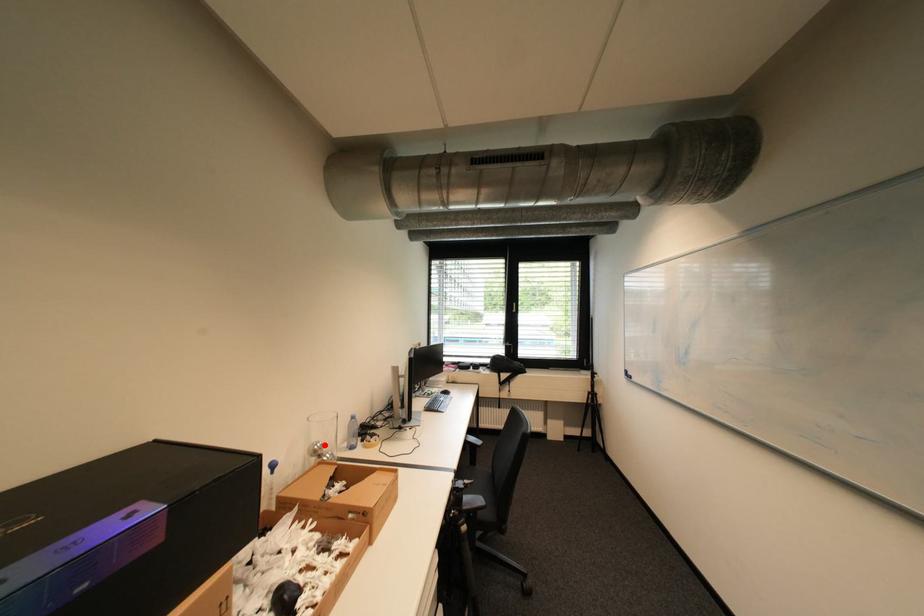
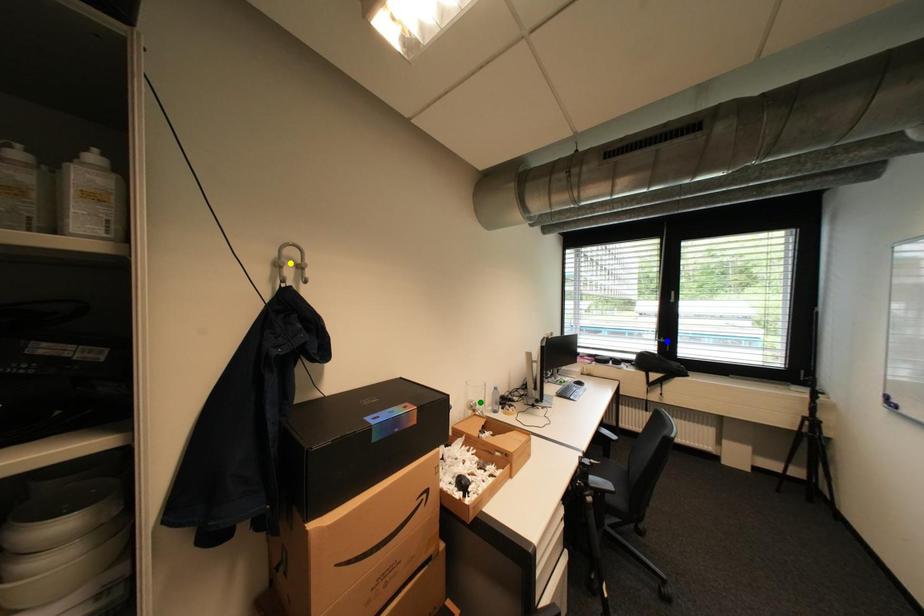
Question: I am providing you with two images of the same scene from different viewpoints. A red point is marked on the first image. You are given multiple points on the second image. Which point in image 2 represents the same 3d spot as the red point in image 1?

Choices:
 (A) blue point
 (B) yellow point
 (C) green point

Answer: (C)